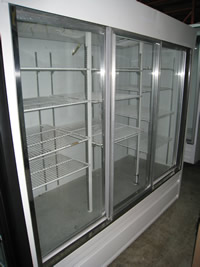
Image resolution: width=200 pixels, height=267 pixels. I want to click on metal shelf rods, so click(x=90, y=187), click(x=136, y=160).